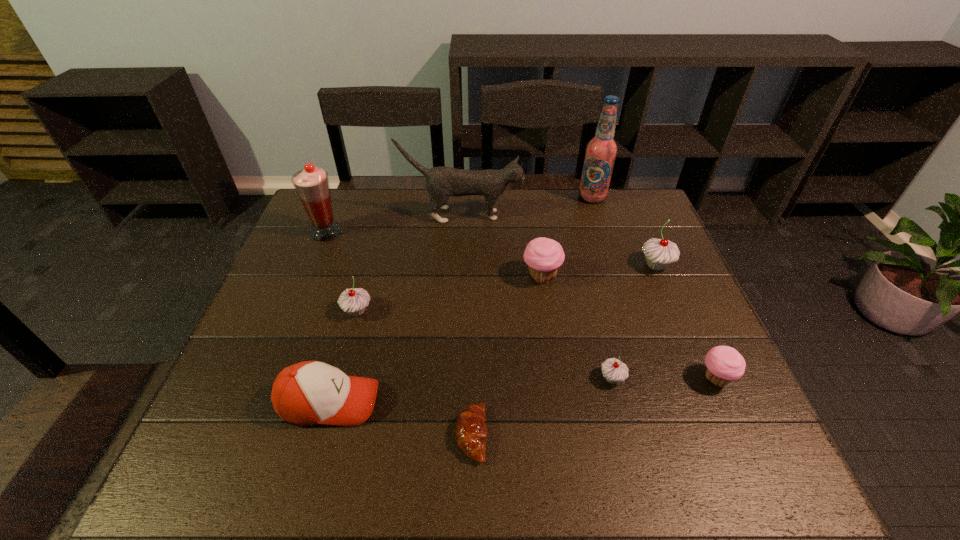
Identify the location of blank space that satisfies the following two spatial constraints: 1. on the back side of the bigger pink cupcake; 2. on the left side of the second smallest gray cupcake. (367, 276).

The image size is (960, 540). I want to click on free space that satisfies the following two spatial constraints: 1. on the front side of the third nearest cupcake; 2. on the left side of the red smoothie, so click(294, 311).